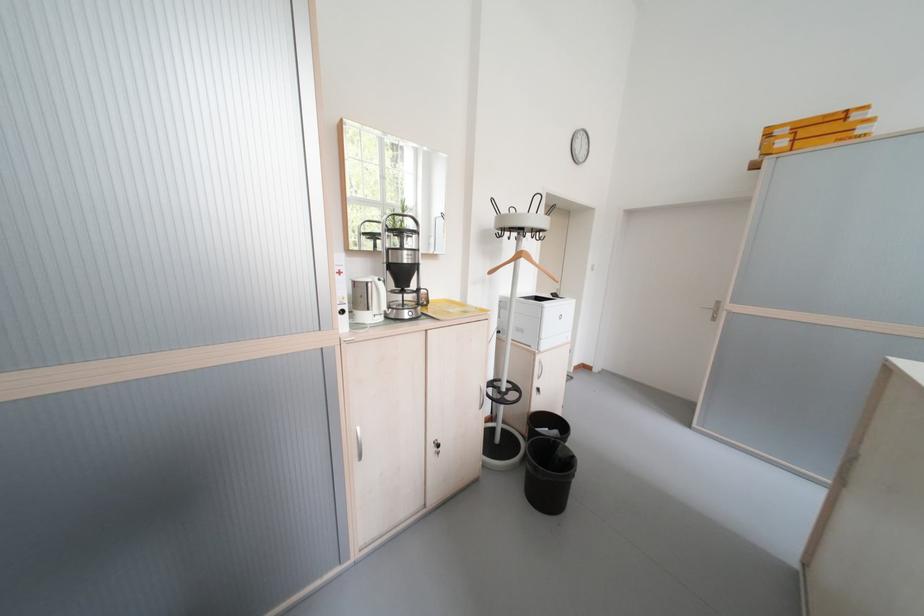
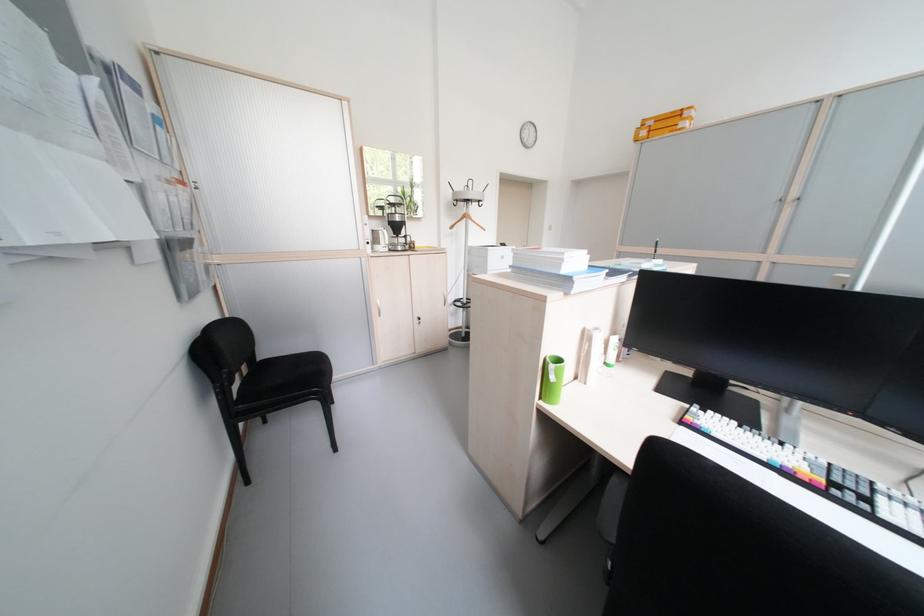
The images are taken continuously from a first-person perspective. In which direction are you moving?

The cameraman moved toward right, backward.